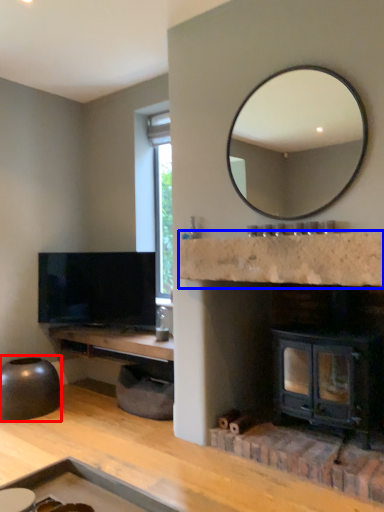
Question: Which point is closer to the camera, round table (highlighted by a red box) or counter top (highlighted by a blue box)?

Choices:
 (A) round table
 (B) counter top

Answer: (B)